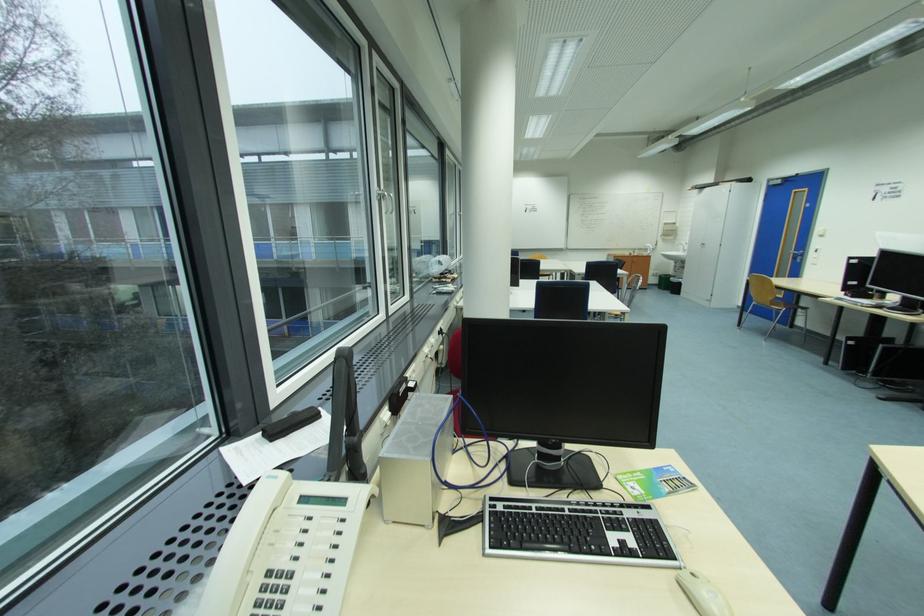
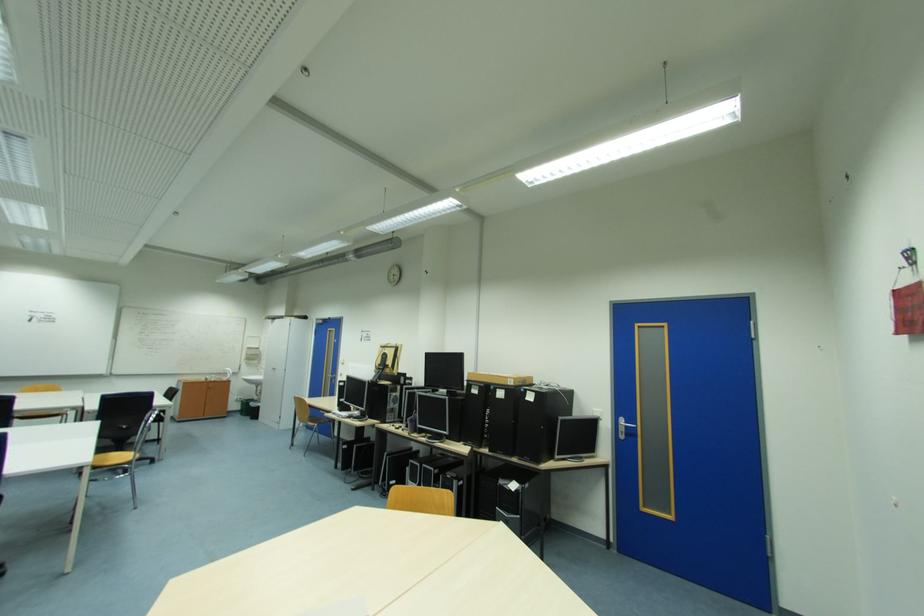
Locate, in the second image, the point that corresponds to (x=666, y=290) in the first image.

(249, 416)